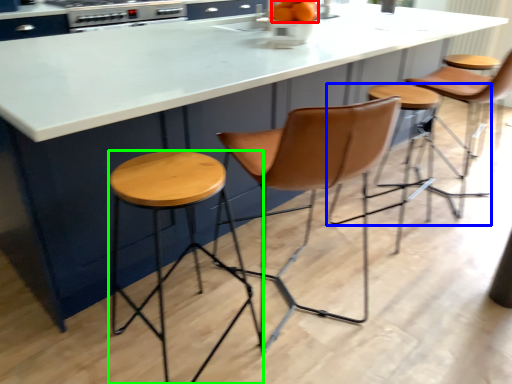
Question: Based on their relative distances, which object is nearer to orange (highlighted by a red box)? Choose from stool (highlighted by a blue box) and stool (highlighted by a green box).

Choices:
 (A) stool
 (B) stool

Answer: (B)